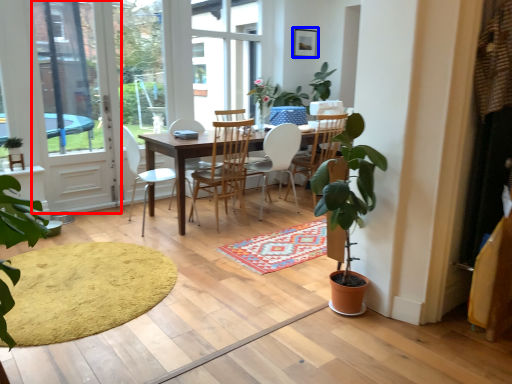
Question: Which object is further to the camera taking this photo, screen door (highlighted by a red box) or picture frame (highlighted by a blue box)?

Choices:
 (A) screen door
 (B) picture frame

Answer: (B)